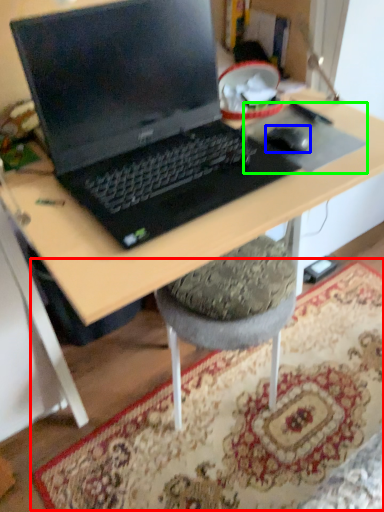
Question: Which object is the farthest from mat (highlighted by a red box)? Choose among these: mouse (highlighted by a blue box) or mousepad (highlighted by a green box).

Choices:
 (A) mouse
 (B) mousepad

Answer: (A)